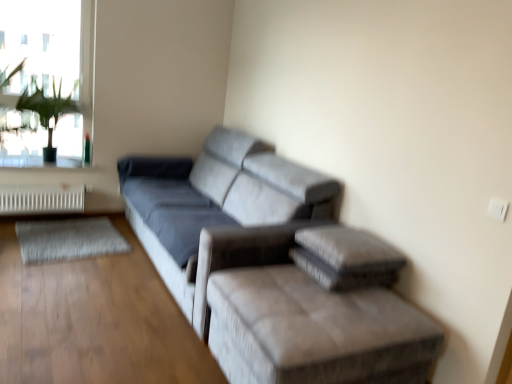
Question: Is suede gray couch at center closer to camera compared to white metallic radiator at lower left?

Choices:
 (A) yes
 (B) no

Answer: (A)

Question: Considering the relative sizes of suede gray couch at center and white metallic radiator at lower left in the image provided, is suede gray couch at center wider than white metallic radiator at lower left?

Choices:
 (A) yes
 (B) no

Answer: (A)

Question: Are suede gray couch at center and white metallic radiator at lower left beside each other?

Choices:
 (A) no
 (B) yes

Answer: (A)

Question: Is suede gray couch at center aimed at white metallic radiator at lower left?

Choices:
 (A) yes
 (B) no

Answer: (A)

Question: Can you confirm if suede gray couch at center is bigger than white metallic radiator at lower left?

Choices:
 (A) yes
 (B) no

Answer: (A)

Question: Is white metallic radiator at lower left at the back of suede gray couch at center?

Choices:
 (A) yes
 (B) no

Answer: (B)

Question: Is velvet gray ottoman at lower right smaller than transparent glass window at upper left?

Choices:
 (A) no
 (B) yes

Answer: (A)

Question: Is velvet gray ottoman at lower right oriented towards transparent glass window at upper left?

Choices:
 (A) no
 (B) yes

Answer: (A)

Question: Considering the relative sizes of velvet gray ottoman at lower right and transparent glass window at upper left in the image provided, is velvet gray ottoman at lower right taller than transparent glass window at upper left?

Choices:
 (A) yes
 (B) no

Answer: (B)

Question: Can you confirm if velvet gray ottoman at lower right is shorter than transparent glass window at upper left?

Choices:
 (A) yes
 (B) no

Answer: (A)

Question: Is velvet gray ottoman at lower right to the right of transparent glass window at upper left from the viewer's perspective?

Choices:
 (A) no
 (B) yes

Answer: (B)

Question: Is velvet gray ottoman at lower right bigger than transparent glass window at upper left?

Choices:
 (A) no
 (B) yes

Answer: (B)

Question: Is white metallic radiator at lower left facing away from green leafy plant at upper left?

Choices:
 (A) no
 (B) yes

Answer: (A)